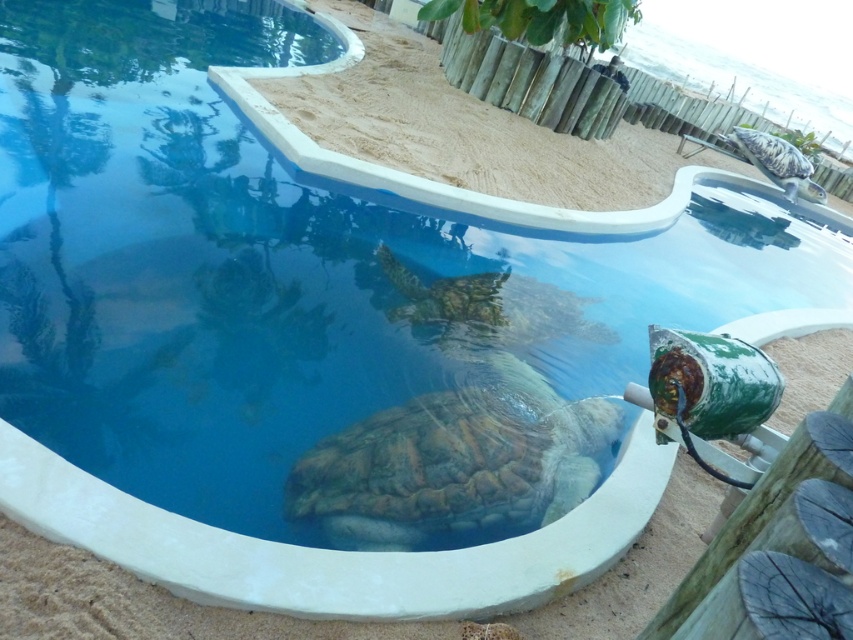
Consider the image. You are a conservationist working at the turtle rehabilitation facility. You need to place a small buoyancy aid on the turtle. Since the turtle is at the center of the pool, where should you position the buoyancy aid relative to the brown textured shell at center and the textured brown tortoise at center?

The brown textured shell at center is to the left of the textured brown tortoise at center, so you should place the buoyancy aid to the right of the brown textured shell at center or to the left of the textured brown tortoise at center to ensure it is near the turtle.

You are a wildlife photographer aiming to capture the turtle in the shallow pool. Since the brown textured shell at center and the textured brown tortoise at center are both in the frame, which one appears taller in the image?

The textured brown tortoise at center appears taller than the brown textured shell at center according to the description.